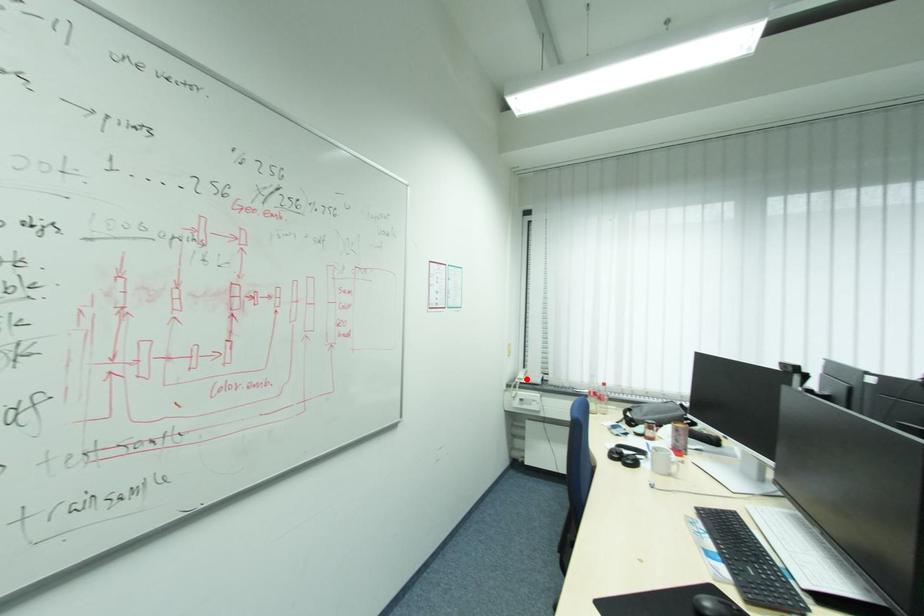
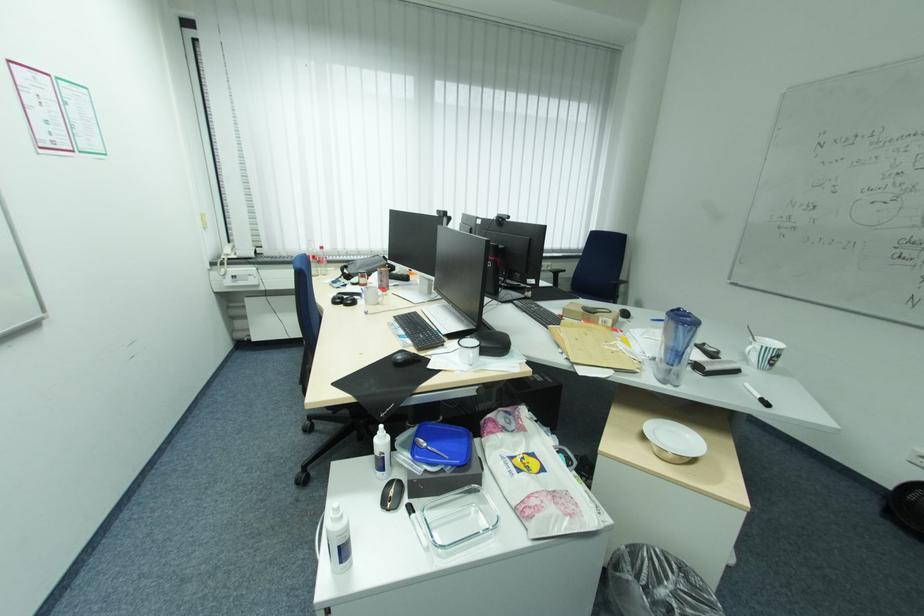
Question: I am providing you with two images of the same scene from different viewpoints. In image1, a red point is highlighted. Considering the same 3D point in image2, which of the following is correct?

Choices:
 (A) It is closer
 (B) It is farther

Answer: (A)